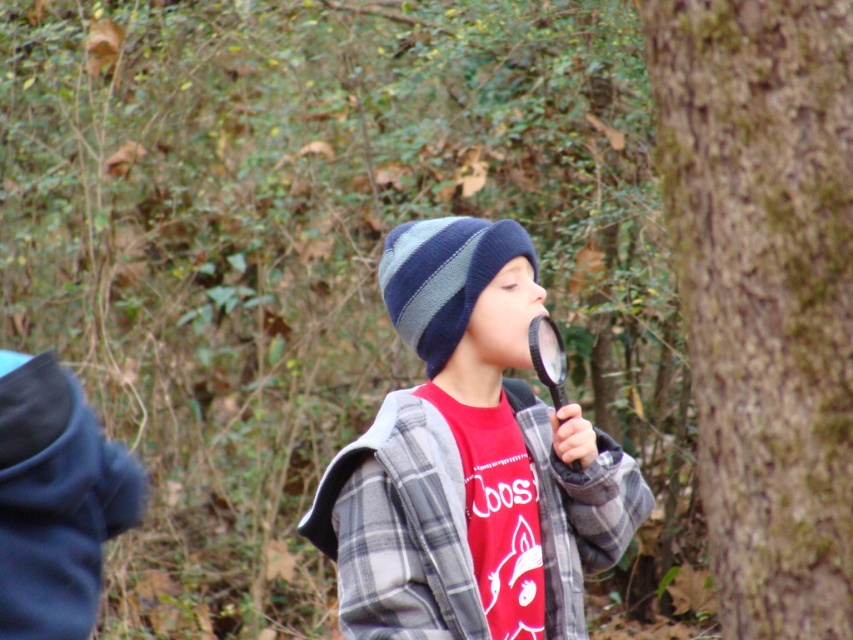
You are a photographer trying to capture the perfect shot of the child holding the magnifying glass. You notice two points in the image labeled as point 1 at coordinates [784,474] and point 2 at coordinates [432,598]. If you want to focus on the point that is closer to your camera, which point should you choose?

Point 1 at coordinates [784,474] is closer to the camera than point 2 at coordinates [432,598], so you should focus on point 1 at coordinates [784,474].

The child is wearing a knit wool beanie at center and a striped knit beanie at center. Which one is larger?

The knit wool beanie at center is bigger than the striped knit beanie at center.

The child is looking at the black plastic magnifying glass at center and the brown rough bark at right. Which object is taller?

The brown rough bark at right is taller than the black plastic magnifying glass at center.